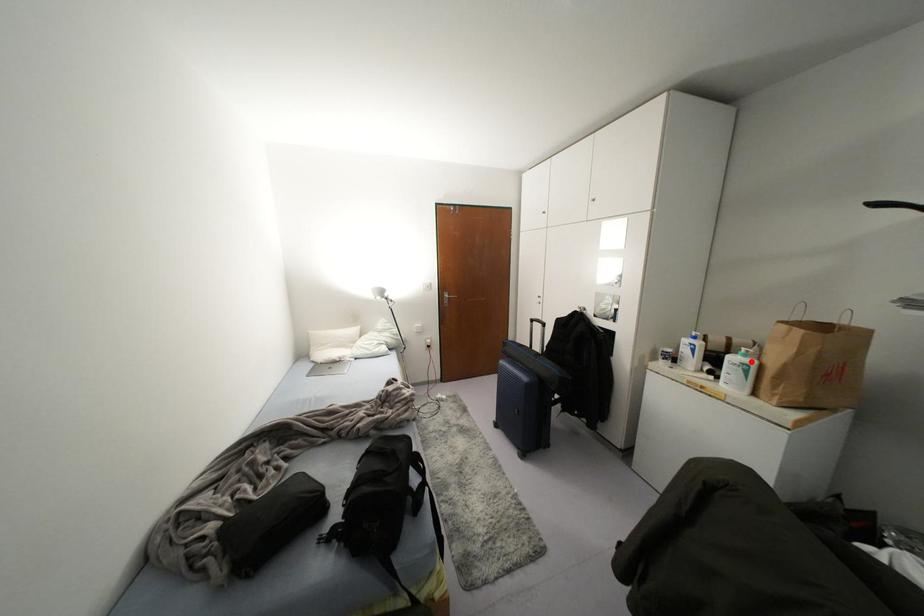
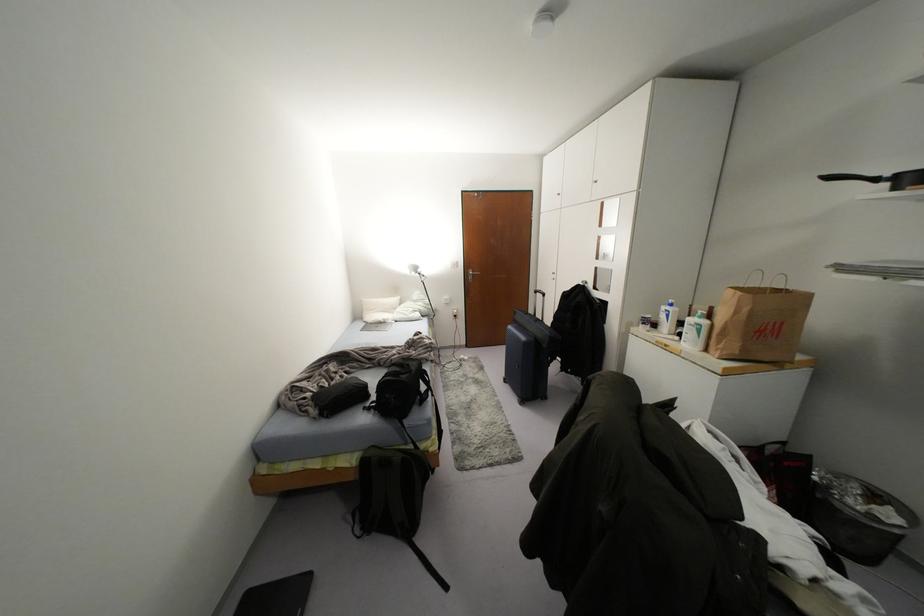
Question: I am providing you with two images of the same scene from different viewpoints. Given a red point in image1, look at the same physical point in image2. Is it:

Choices:
 (A) Closer to the viewpoint
 (B) Farther from the viewpoint

Answer: (A)